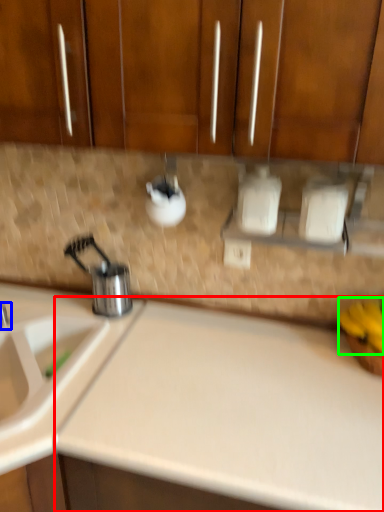
Question: Which object is positioned closest to counter top (highlighted by a red box)? Select from tap (highlighted by a blue box) and banana (highlighted by a green box).

Choices:
 (A) tap
 (B) banana

Answer: (B)